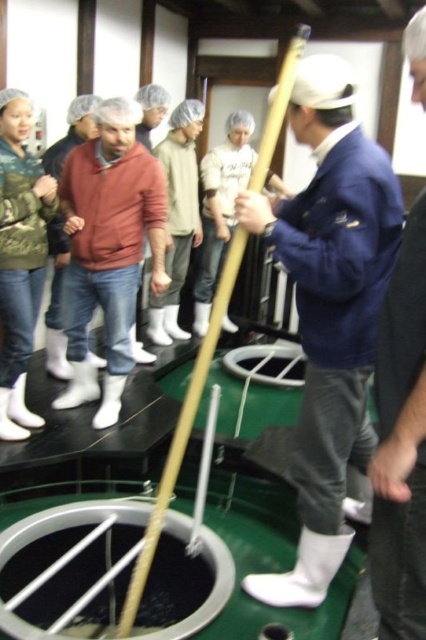
You are a tour guide at the brewery and need to ensure safety distances between visitors. The recommended distance between visitors is 6 feet. Are the two visitors wearing the white matte jacket at center and the green textured jacket at upper left maintaining the required distance?

The white matte jacket at center and the green textured jacket at upper left are 6.27 feet apart, which meets the recommended 6 feet distance requirement.

You are a visitor at the sake brewery and notice the white matte jacket at center and the white plastic hole at center. Which one is smaller in size?

The white matte jacket at center is smaller than the white plastic hole at center.